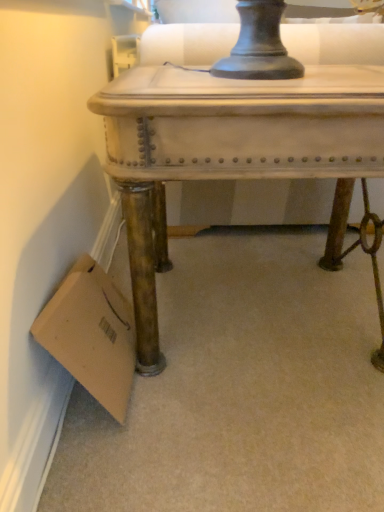
Question: Are brown cardboard at lower left and distressed white table at center making contact?

Choices:
 (A) no
 (B) yes

Answer: (A)

Question: From the image's perspective, is brown cardboard at lower left beneath distressed white table at center?

Choices:
 (A) yes
 (B) no

Answer: (A)

Question: Can you confirm if brown cardboard at lower left is positioned to the right of distressed white table at center?

Choices:
 (A) yes
 (B) no

Answer: (B)

Question: Considering the relative sizes of brown cardboard at lower left and distressed white table at center in the image provided, is brown cardboard at lower left wider than distressed white table at center?

Choices:
 (A) yes
 (B) no

Answer: (B)

Question: Does brown cardboard at lower left have a larger size compared to distressed white table at center?

Choices:
 (A) yes
 (B) no

Answer: (B)

Question: From a real-world perspective, is brown cardboard at lower left under distressed white table at center?

Choices:
 (A) no
 (B) yes

Answer: (B)

Question: Would you consider distressed white table at center to be distant from brown cardboard at lower left?

Choices:
 (A) yes
 (B) no

Answer: (B)

Question: Does distressed white table at center have a greater width compared to brown cardboard at lower left?

Choices:
 (A) no
 (B) yes

Answer: (B)

Question: Is distressed white table at center thinner than brown cardboard at lower left?

Choices:
 (A) yes
 (B) no

Answer: (B)

Question: Is distressed white table at center not within brown cardboard at lower left?

Choices:
 (A) no
 (B) yes

Answer: (B)

Question: Does distressed white table at center come in front of brown cardboard at lower left?

Choices:
 (A) no
 (B) yes

Answer: (B)

Question: Is distressed white table at center facing towards brown cardboard at lower left?

Choices:
 (A) no
 (B) yes

Answer: (A)

Question: Looking at the image, does distressed white table at center seem bigger or smaller compared to brown cardboard at lower left?

Choices:
 (A) small
 (B) big

Answer: (B)